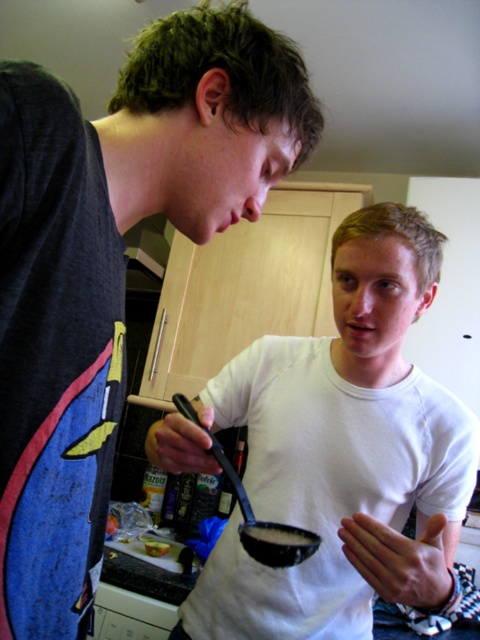
Which is more to the left, black glossy pan at center or yellowish matte bread at lower left?

Positioned to the left is yellowish matte bread at lower left.

Is black glossy pan at center shorter than yellowish matte bread at lower left?

In fact, black glossy pan at center may be taller than yellowish matte bread at lower left.

Is point (256, 534) positioned behind point (144, 547)?

That is False.

Where is `black glossy pan at center`? The image size is (480, 640). black glossy pan at center is located at coordinates (277, 536).

Based on the photo, is white matte bowl at center positioned behind yellowish matte bread at lower left?

No, it is in front of yellowish matte bread at lower left.

Locate an element on the screen. This screenshot has height=640, width=480. white matte bowl at center is located at coordinates (343, 451).

Is white matte shirt at center shorter than black glossy pan at center?

No, white matte shirt at center is not shorter than black glossy pan at center.

Can you confirm if white matte shirt at center is positioned to the right of black glossy pan at center?

Incorrect, white matte shirt at center is not on the right side of black glossy pan at center.

Where is `white matte shirt at center`? This screenshot has height=640, width=480. white matte shirt at center is located at coordinates 112,266.

Where is `white matte shirt at center`? The height and width of the screenshot is (640, 480). white matte shirt at center is located at coordinates (112, 266).